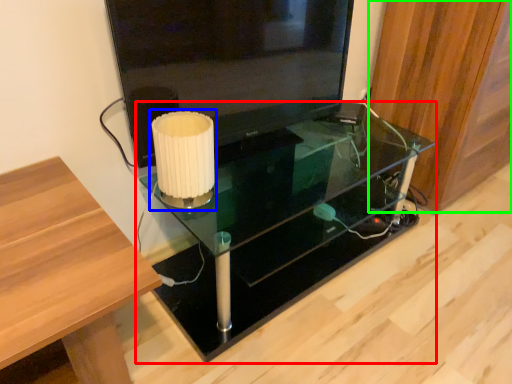
Question: Which object is positioned farthest from table (highlighted by a red box)? Select from table lamp (highlighted by a blue box) and wood (highlighted by a green box).

Choices:
 (A) table lamp
 (B) wood

Answer: (A)